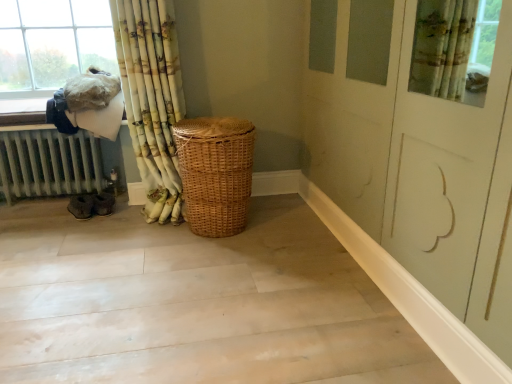
Where is `free point in front of woven natural basket at center`? free point in front of woven natural basket at center is located at coordinates (215, 268).